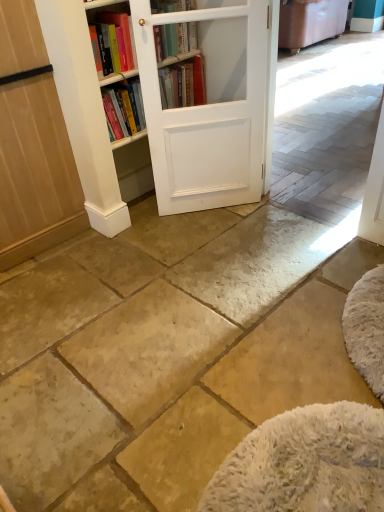
This screenshot has width=384, height=512. Find the location of `natural stone floor at center`. natural stone floor at center is located at coordinates (167, 352).

What are the coordinates of `hardcover book at upper center` in the screenshot? It's located at (174, 39).

What is the approximate width of white wood bookcase at center?

white wood bookcase at center is 5.41 meters in width.

Describe the element at coordinates (212, 104) in the screenshot. The height and width of the screenshot is (512, 384). I see `white matte barn door at center` at that location.

Where is `natural stone floor at center`? natural stone floor at center is located at coordinates (167, 352).

From a real-world perspective, which object stands above the other?

white matte barn door at center is physically above.

Does white matte barn door at center have a lesser height compared to white wood bookcase at center?

In fact, white matte barn door at center may be taller than white wood bookcase at center.

Is white matte barn door at center spatially inside white wood bookcase at center, or outside of it?

white matte barn door at center lies outside white wood bookcase at center.

Is white matte barn door at center looking in the opposite direction of white wood bookcase at center?

white matte barn door at center does not have its back to white wood bookcase at center.

From the picture: From their relative heights in the image, would you say white matte barn door at center is taller or shorter than hardcover book at upper center?

white matte barn door at center is taller than hardcover book at upper center.

Which is nearer, (159,158) or (173,26)?

The point (173,26) is closer.

Who is smaller, white matte barn door at center or hardcover book at upper center?

hardcover book at upper center is smaller.

From a real-world perspective, is white matte barn door at center positioned under natural stone floor at center based on gravity?

Actually, white matte barn door at center is physically above natural stone floor at center in the real world.

Based on their sizes in the image, would you say white matte barn door at center is bigger or smaller than natural stone floor at center?

Clearly, white matte barn door at center is smaller in size than natural stone floor at center.

Which object is closer to the camera taking this photo, white matte barn door at center or natural stone floor at center?

natural stone floor at center is closer to the camera.

Which of these two, white matte barn door at center or natural stone floor at center, is thinner?

white matte barn door at center.

From the image's perspective, is hardcover book at upper center below light brown wood screen door at left?

Actually, hardcover book at upper center appears above light brown wood screen door at left in the image.

Consider the image. Does hardcover book at upper center have a greater width compared to light brown wood screen door at left?

No, hardcover book at upper center is not wider than light brown wood screen door at left.

The image size is (384, 512). What are the coordinates of `book above the light brown wood screen door at left (from a real-world perspective)` in the screenshot? It's located at (174, 39).

Is hardcover book at upper center inside or outside of light brown wood screen door at left?

hardcover book at upper center lies outside light brown wood screen door at left.

From the picture: Considering the relative sizes of white matte barn door at center and light brown wood screen door at left in the image provided, is white matte barn door at center thinner than light brown wood screen door at left?

Correct, the width of white matte barn door at center is less than that of light brown wood screen door at left.

Is the surface of white matte barn door at center in direct contact with light brown wood screen door at left?

No, white matte barn door at center is not in contact with light brown wood screen door at left.

Considering the relative positions of white matte barn door at center and light brown wood screen door at left in the image provided, is white matte barn door at center to the left or to the right of light brown wood screen door at left?

Based on their positions, white matte barn door at center is located to the right of light brown wood screen door at left.

From a real-world perspective, is white matte barn door at center above or below light brown wood screen door at left?

white matte barn door at center is below light brown wood screen door at left.

The image size is (384, 512). I want to click on barn door on the left of white wood bookcase at center, so click(212, 104).

From a real-world perspective, which object rests below the other?

white wood bookcase at center, from a real-world perspective.

Is white matte barn door at center at the back of white wood bookcase at center?

white wood bookcase at center does not have its back to white matte barn door at center.

From the image's perspective, is white wood bookcase at center below white matte barn door at center?

No.

Is natural stone floor at center located within hardcover book at upper center?

No, natural stone floor at center is not inside hardcover book at upper center.

From a real-world perspective, which object stands above the other?

hardcover book at upper center is physically above.

Which object is more forward, hardcover book at upper center or natural stone floor at center?

Positioned in front is natural stone floor at center.

Is hardcover book at upper center facing towards natural stone floor at center?

No.

Image resolution: width=384 pixels, height=512 pixels. I want to click on barn door on the left side of white wood bookcase at center, so click(x=212, y=104).

Identify the location of barn door that appears below the hardcover book at upper center (from a real-world perspective). (212, 104).

When comparing their distances from natural stone floor at center, does white wood bookcase at center or light brown wood screen door at left seem further?

white wood bookcase at center lies further to natural stone floor at center than the other object.

Considering their positions, is white wood bookcase at center positioned further to light brown wood screen door at left than hardcover book at upper center?

hardcover book at upper center is further to light brown wood screen door at left.

Estimate the real-world distances between objects in this image. Which object is further from white wood bookcase at center, hardcover book at upper center or natural stone floor at center?

natural stone floor at center.

When comparing their distances from natural stone floor at center, does white wood bookcase at center or hardcover book at upper center seem further?

Based on the image, hardcover book at upper center appears to be further to natural stone floor at center.

Consider the image. Which object lies further to the anchor point white matte barn door at center, hardcover book at upper center or natural stone floor at center?

natural stone floor at center is positioned further to the anchor white matte barn door at center.

Estimate the real-world distances between objects in this image. Which object is closer to white matte barn door at center, light brown wood screen door at left or white wood bookcase at center?

Based on the image, white wood bookcase at center appears to be nearer to white matte barn door at center.

Considering their positions, is natural stone floor at center positioned further to white matte barn door at center than hardcover book at upper center?

Among the two, natural stone floor at center is located further to white matte barn door at center.

Estimate the real-world distances between objects in this image. Which object is closer to hardcover book at upper center, white wood bookcase at center or light brown wood screen door at left?

white wood bookcase at center lies closer to hardcover book at upper center than the other object.

At what (x,y) coordinates should I click in order to perform the action: click on barn door between white wood bookcase at center and natural stone floor at center vertically. Please return your answer as a coordinate pair (x, y). This screenshot has height=512, width=384. Looking at the image, I should click on (212, 104).

Locate an element on the screen. This screenshot has height=512, width=384. barn door between hardcover book at upper center and white wood bookcase at center in the horizontal direction is located at coordinates (212, 104).

Locate an element on the screen. book located between light brown wood screen door at left and white matte barn door at center in the left-right direction is located at coordinates (174, 39).

I want to click on concrete between light brown wood screen door at left and white matte barn door at center in the horizontal direction, so click(167, 352).